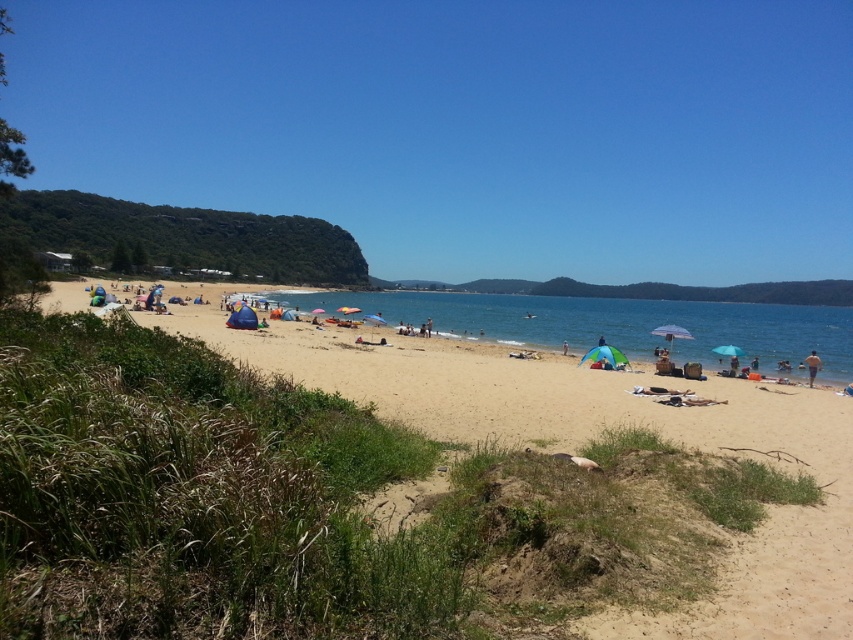
Who is more forward, (577, 300) or (807, 362)?

Point (807, 362)

Does clear blue water at center appear under tan skin person at lower right?

No.

The height and width of the screenshot is (640, 853). Identify the location of clear blue water at center. (614, 324).

Can you confirm if transparent blue sky at upper center is bigger than blue fabric umbrella at center?

Correct, transparent blue sky at upper center is larger in size than blue fabric umbrella at center.

In order to click on transparent blue sky at upper center in this screenshot , I will do `click(465, 128)`.

Does clear blue water at center have a smaller size compared to blue fabric umbrella at center?

No.

Is point (538, 316) closer to viewer compared to point (611, 364)?

That is False.

What do you see at coordinates (614, 324) in the screenshot? I see `clear blue water at center` at bounding box center [614, 324].

Image resolution: width=853 pixels, height=640 pixels. I want to click on clear blue water at center, so click(614, 324).